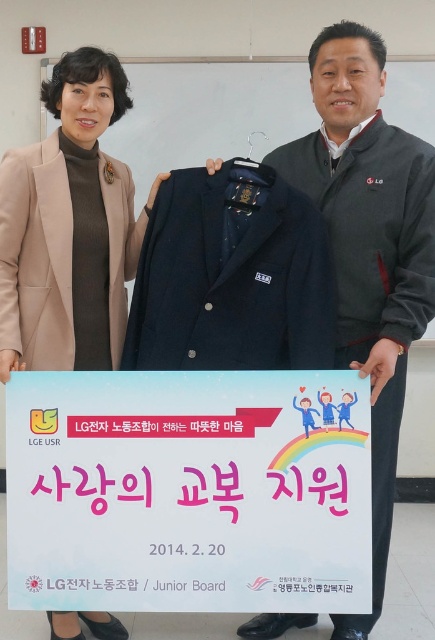
Based on the scene described, which object is positioned higher between the white paper sign at center and the beige woolen coat at upper left?

The beige woolen coat at upper left is positioned higher than the white paper sign at center because it is located above the sign.

You are a delivery person who needs to deliver a package to the white paper sign at center. The minimum distance required to safely place the package is 5 feet. Can you safely deliver the package?

They are 6.73 feet apart, so yes, the delivery person can safely deliver the package to the white paper sign at center since the distance is more than the required 5 feet.

Based on the scene description, what does the point at coordinates (188, 492) represent?

The point at coordinates (188, 492) indicates the location of the white paper sign at center.